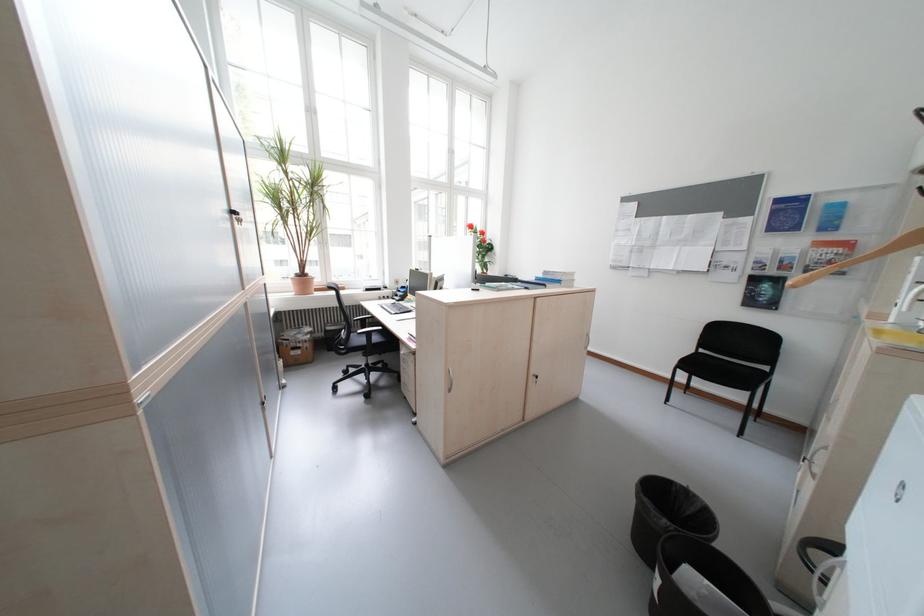
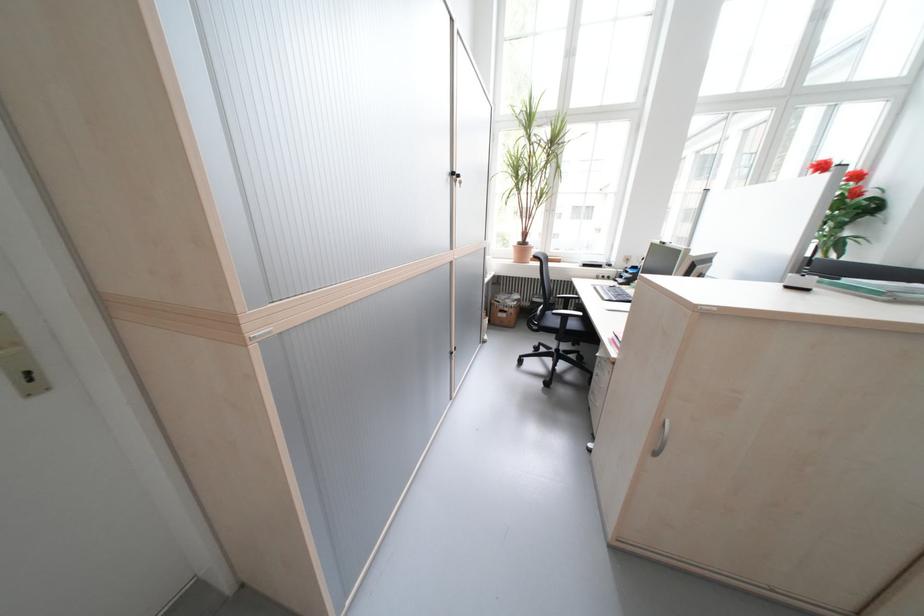
Question: The camera is either moving clockwise (left) or counter-clockwise (right) around the object. The first image is from the beginning of the video and the second image is from the end. Is the camera moving left or right when shooting the video?

Choices:
 (A) Left
 (B) Right

Answer: (B)